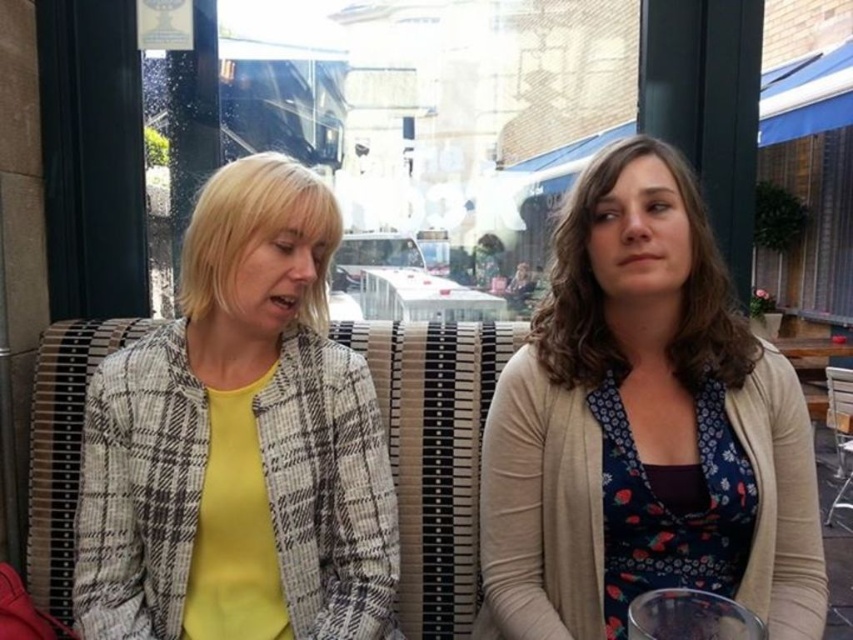
Between point (180, 515) and point (361, 285), which one is positioned in front?

Point (180, 515) is in front.

Is plaid fabric jacket at left thinner than white plastic table at center?

No, plaid fabric jacket at left is not thinner than white plastic table at center.

Which is in front, point (289, 333) or point (506, 312)?

Point (289, 333) is in front.

Where is `plaid fabric jacket at left`? plaid fabric jacket at left is located at coordinates (239, 442).

Which is above, floral print blouse at center or plaid fabric jacket at left?

plaid fabric jacket at left is higher up.

Does floral print blouse at center appear on the right side of plaid fabric jacket at left?

Indeed, floral print blouse at center is positioned on the right side of plaid fabric jacket at left.

Describe the element at coordinates (643, 428) in the screenshot. I see `floral print blouse at center` at that location.

Locate an element on the screen. This screenshot has height=640, width=853. floral print blouse at center is located at coordinates (643, 428).

Does floral print blouse at center have a larger size compared to white plastic table at center?

Yes.

Does floral print blouse at center appear on the right side of white plastic table at center?

Correct, you'll find floral print blouse at center to the right of white plastic table at center.

Which is behind, point (750, 467) or point (463, 291)?

The point (463, 291) is more distant.

The width and height of the screenshot is (853, 640). I want to click on floral print blouse at center, so click(x=643, y=428).